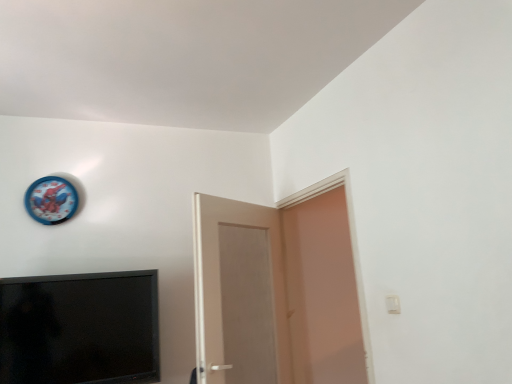
Question: Considering the positions of matte white door at right, which ranks as the 2th door in left-to-right order, and blue plastic clock at upper left in the image, is matte white door at right, which ranks as the 2th door in left-to-right order, bigger or smaller than blue plastic clock at upper left?

Choices:
 (A) big
 (B) small

Answer: (A)

Question: Is matte white door at right, arranged as the first door when viewed from the right, taller or shorter than blue plastic clock at upper left?

Choices:
 (A) tall
 (B) short

Answer: (A)

Question: Which object is positioned farthest from the blue plastic clock at upper left?

Choices:
 (A) black matte television at lower left
 (B) matte white door at right, which ranks as the 2th door in left-to-right order
 (C) white matte door at center, the 2th door viewed from the right

Answer: (B)

Question: Which of these objects is positioned closest to the matte white door at right, which ranks as the 2th door in left-to-right order?

Choices:
 (A) blue plastic clock at upper left
 (B) black matte television at lower left
 (C) white matte door at center, the 2th door viewed from the right

Answer: (C)